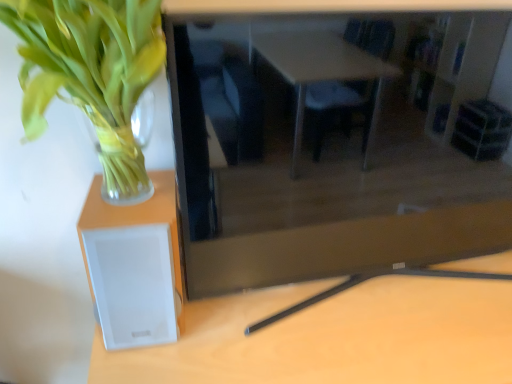
Question: In the image, is white plastic speaker at lower left positioned in front of or behind white matte speaker at left?

Choices:
 (A) behind
 (B) front

Answer: (B)

Question: In terms of size, does white plastic speaker at lower left appear bigger or smaller than white matte speaker at left?

Choices:
 (A) small
 (B) big

Answer: (B)

Question: Which object is the farthest from the white matte speaker at left?

Choices:
 (A) green leafy plant at left
 (B) matte black tv at center
 (C) white plastic speaker at lower left

Answer: (B)

Question: Which of these objects is positioned closest to the matte black tv at center?

Choices:
 (A) white plastic speaker at lower left
 (B) white matte speaker at left
 (C) green leafy plant at left

Answer: (A)